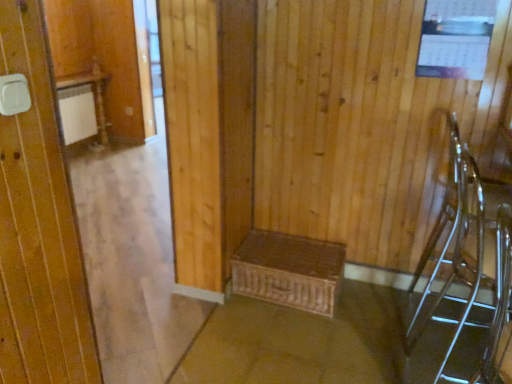
What are the coordinates of `vacant area situated to the left side of clear glass armchair at right, the 2th armchair positioned from the front` in the screenshot? It's located at (361, 363).